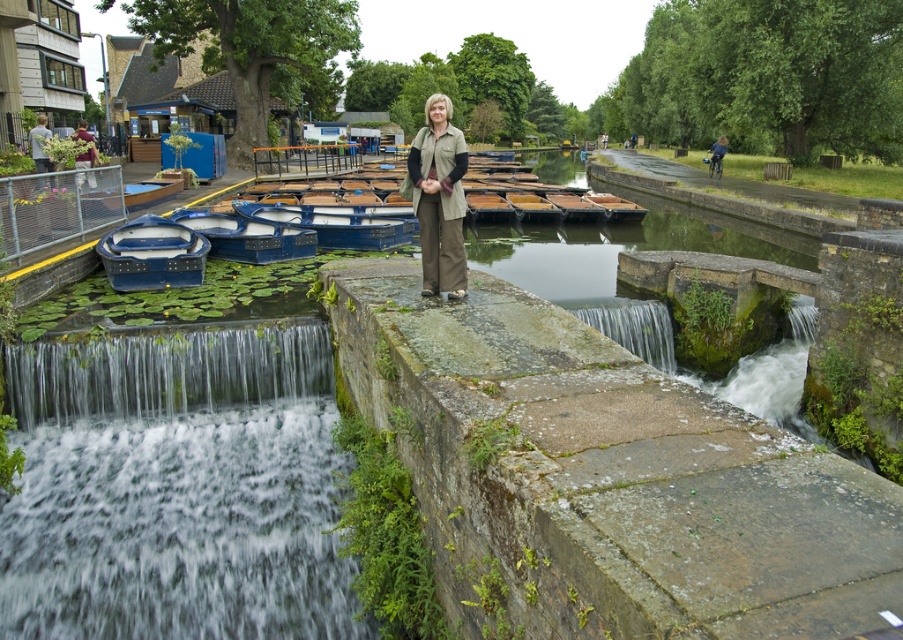
You are standing at the point labeled point [634,209] and want to move to the point labeled point [421,220]. According to the scene description, which direction should you move to reach your destination?

To move from point [634,209] to point [421,220], you should move forward since point [421,220] is in front of point [634,209].

You are standing at the point marked as point (x=334, y=224). What object is located exactly at your current position?

The blue polished wood boat at center is located exactly at point (x=334, y=224).